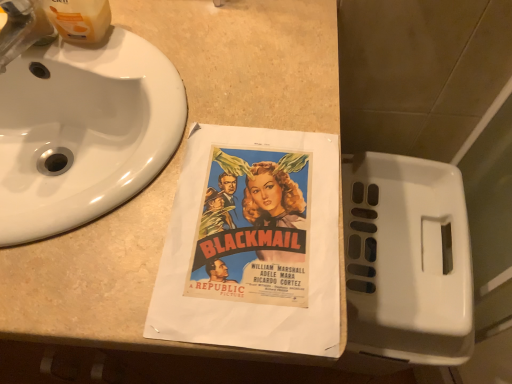
The image size is (512, 384). In order to click on vacant area on top of beige laminate counter at center (from a real-world perspective) in this screenshot , I will do `click(166, 145)`.